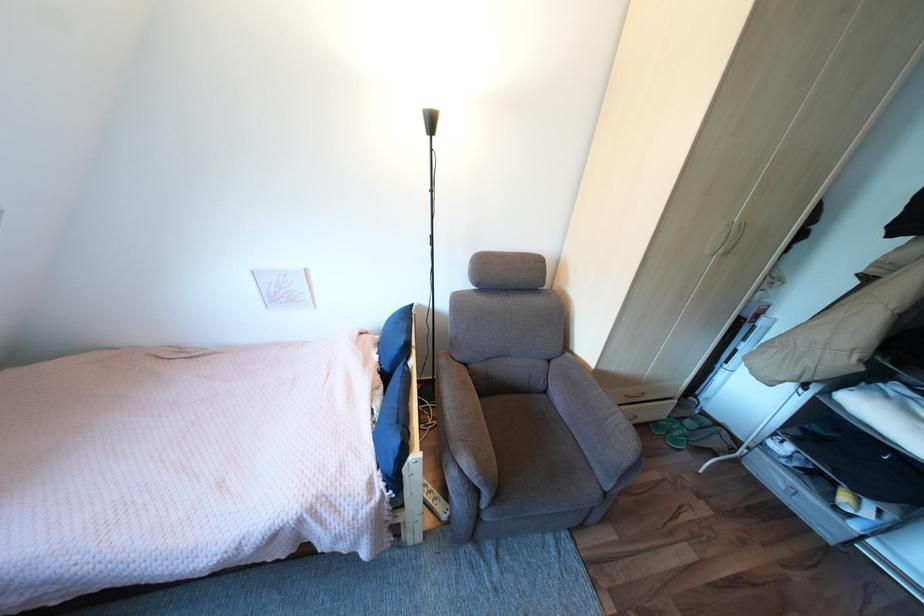
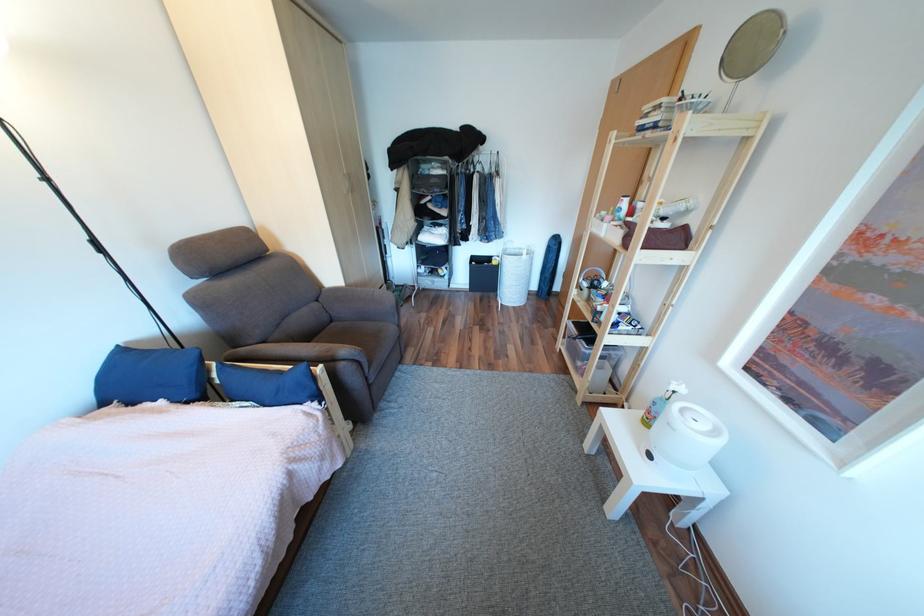
The point at [397,370] is marked in the first image. Where is the corresponding point in the second image?

(205, 395)